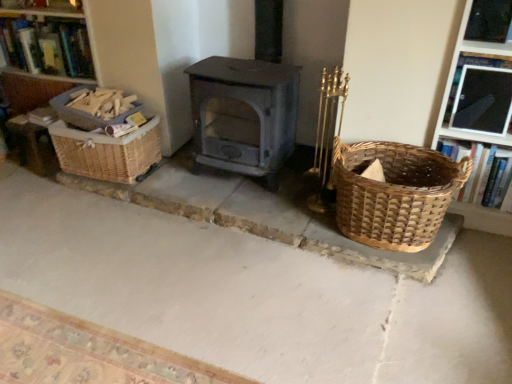
Question: Would you say natural stone basket at lower right is a long distance from woven brown basket at left, which appears as the second basket when viewed from the left?

Choices:
 (A) yes
 (B) no

Answer: (B)

Question: Considering the relative positions of natural stone basket at lower right and woven brown basket at left, which appears as the second basket when viewed from the left, in the image provided, is natural stone basket at lower right to the left of woven brown basket at left, which appears as the second basket when viewed from the left, from the viewer's perspective?

Choices:
 (A) no
 (B) yes

Answer: (A)

Question: From a real-world perspective, is natural stone basket at lower right physically below woven brown basket at left, acting as the second basket starting from the right?

Choices:
 (A) yes
 (B) no

Answer: (A)

Question: Is natural stone basket at lower right at the right side of woven brown basket at left, which appears as the second basket when viewed from the left?

Choices:
 (A) no
 (B) yes

Answer: (B)

Question: Is natural stone basket at lower right positioned behind woven brown basket at left, which appears as the second basket when viewed from the left?

Choices:
 (A) yes
 (B) no

Answer: (B)

Question: Based on their positions, is natural stone basket at lower right located to the left or right of woven wood basket at left, which is the third basket in right-to-left order?

Choices:
 (A) right
 (B) left

Answer: (A)

Question: In terms of height, does natural stone basket at lower right look taller or shorter compared to woven wood basket at left, placed as the 1th basket when sorted from left to right?

Choices:
 (A) short
 (B) tall

Answer: (A)

Question: Is natural stone basket at lower right spatially inside woven wood basket at left, placed as the 1th basket when sorted from left to right, or outside of it?

Choices:
 (A) inside
 (B) outside

Answer: (B)

Question: Considering the positions of natural stone basket at lower right and woven wood basket at left, which is the third basket in right-to-left order, in the image, is natural stone basket at lower right wider or thinner than woven wood basket at left, which is the third basket in right-to-left order,?

Choices:
 (A) thin
 (B) wide

Answer: (B)

Question: From a real-world perspective, is woven wood basket at left, which is the third basket in right-to-left order, above or below woven brown basket at left, which appears as the second basket when viewed from the left?

Choices:
 (A) above
 (B) below

Answer: (A)

Question: Is woven wood basket at left, which is the third basket in right-to-left order, spatially inside woven brown basket at left, which appears as the second basket when viewed from the left, or outside of it?

Choices:
 (A) outside
 (B) inside

Answer: (A)

Question: Considering the positions of point click(72, 122) and point click(151, 163), is point click(72, 122) closer or farther from the camera than point click(151, 163)?

Choices:
 (A) closer
 (B) farther

Answer: (A)

Question: In terms of height, does woven wood basket at left, placed as the 1th basket when sorted from left to right, look taller or shorter compared to woven brown basket at left, which appears as the second basket when viewed from the left?

Choices:
 (A) tall
 (B) short

Answer: (B)

Question: Is woven brown basket at right, the 1th basket viewed from the right, wider or thinner than woven brown basket at left, acting as the second basket starting from the right?

Choices:
 (A) thin
 (B) wide

Answer: (B)

Question: Is woven brown basket at right, the 1th basket viewed from the right, situated inside woven brown basket at left, which appears as the second basket when viewed from the left, or outside?

Choices:
 (A) inside
 (B) outside

Answer: (B)